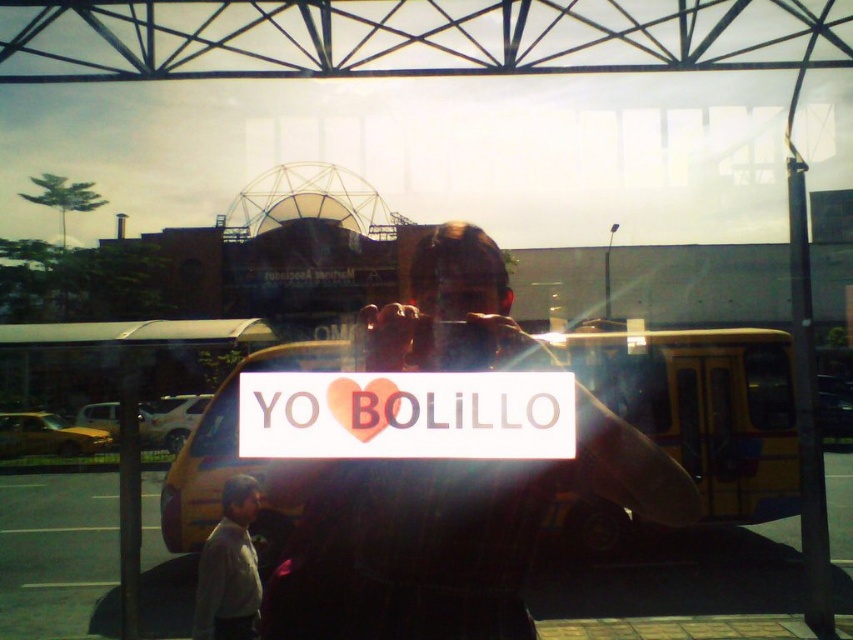
You are a photographer trying to capture the white matte sign at center and the gray fabric shirt at lower left in a single shot. Considering their sizes in the frame, which object should you focus on first to ensure it is clearly visible?

The white matte sign at center occupies less space than the gray fabric shirt at lower left, so you should focus on the gray fabric shirt at lower left first since it is larger and more prominent in the frame.

You are a photographer trying to capture the matte black sign at center and the gray fabric shirt at lower left in a single shot. Given that the camera can only focus on one object at a time, which object should you prioritize focusing on to ensure it appears clear in the photo?

The matte black sign at center should be prioritized for focus since it is larger than the gray fabric shirt at lower left, making it more prominent in the frame.